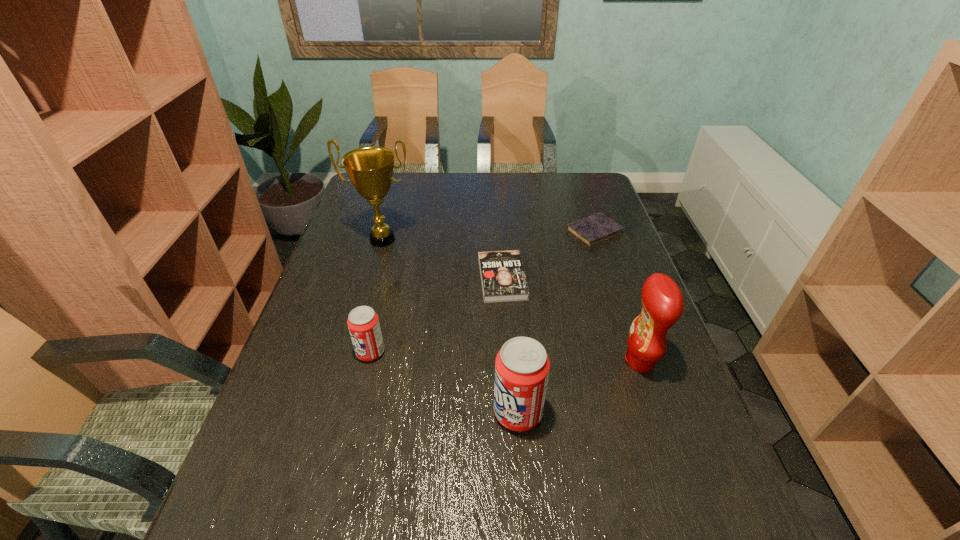
The image size is (960, 540). In order to click on blank area located on the surface of the shorter soda can in this screenshot , I will do `click(336, 352)`.

The height and width of the screenshot is (540, 960). In order to click on free space located 0.070m on the surface of the shorter soda can in this screenshot , I will do `click(327, 352)`.

Identify the location of vacant position located on the surface of the nearest object. (382, 413).

Identify the location of vacant region located 0.140m on the surface of the nearest object. (428, 413).

Find the location of a particular element. The height and width of the screenshot is (540, 960). vacant space located 0.140m on the surface of the nearest object is located at coordinates (428, 413).

The image size is (960, 540). What are the coordinates of `vacant space located on the back of the diary` in the screenshot? It's located at (575, 175).

Where is `vacant space situated on the front of the second shortest object`? The width and height of the screenshot is (960, 540). vacant space situated on the front of the second shortest object is located at coordinates (505, 322).

The width and height of the screenshot is (960, 540). In order to click on vacant area situated on the front view with handles of the award in this screenshot , I will do `click(357, 331)`.

Where is `free space located on the label side of the second tallest object`? This screenshot has height=540, width=960. free space located on the label side of the second tallest object is located at coordinates (573, 361).

Identify the location of blank space located on the label side of the second tallest object. The image size is (960, 540). (569, 361).